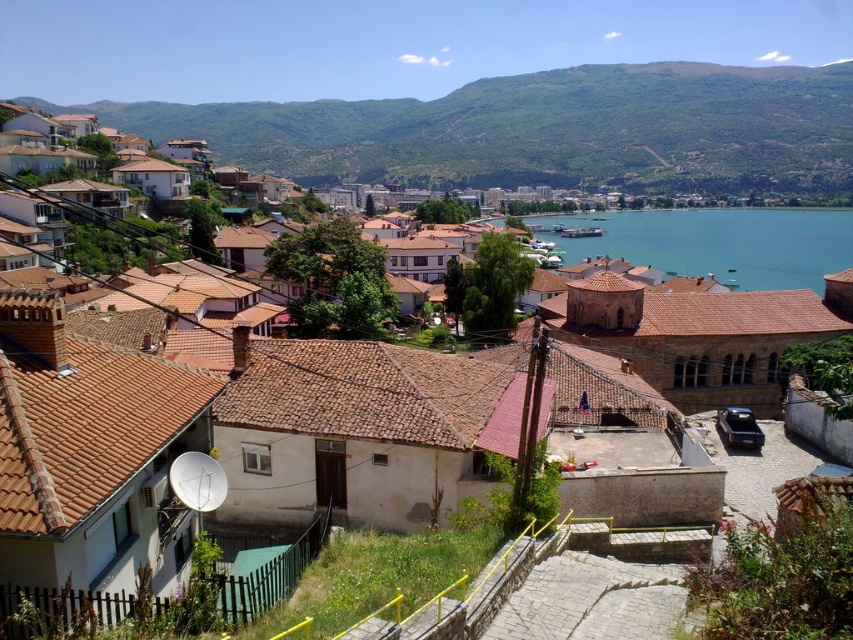
Is green grassy hillside at upper center further to camera compared to blue water at center?

That is True.

Does point (474, 83) come in front of point (595, 212)?

No, (474, 83) is behind (595, 212).

Find the location of `green grassy hillside at upper center`. green grassy hillside at upper center is located at coordinates (546, 131).